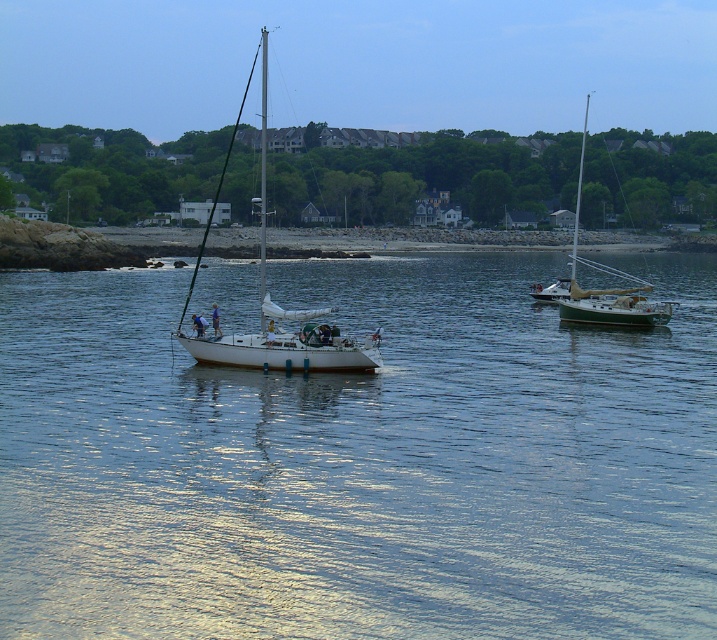
Question: Which object is the closest to the clear blue water at center?

Choices:
 (A) white glossy sailboat at center
 (B) white glossy sailboat at right

Answer: (A)

Question: Considering the relative positions of white glossy sailboat at center and white glossy sailboat at right in the image provided, where is white glossy sailboat at center located with respect to white glossy sailboat at right?

Choices:
 (A) left
 (B) right

Answer: (A)

Question: Which point is closer to the camera taking this photo?

Choices:
 (A) (571, 314)
 (B) (272, 333)

Answer: (B)

Question: Is clear blue water at center smaller than smooth sand shoreline at center?

Choices:
 (A) no
 (B) yes

Answer: (B)

Question: Is clear blue water at center thinner than smooth sand shoreline at center?

Choices:
 (A) yes
 (B) no

Answer: (A)

Question: Estimate the real-world distances between objects in this image. Which object is farther from the white glossy sailboat at center?

Choices:
 (A) white glossy sailboat at right
 (B) clear blue water at center
 (C) smooth sand shoreline at center

Answer: (A)